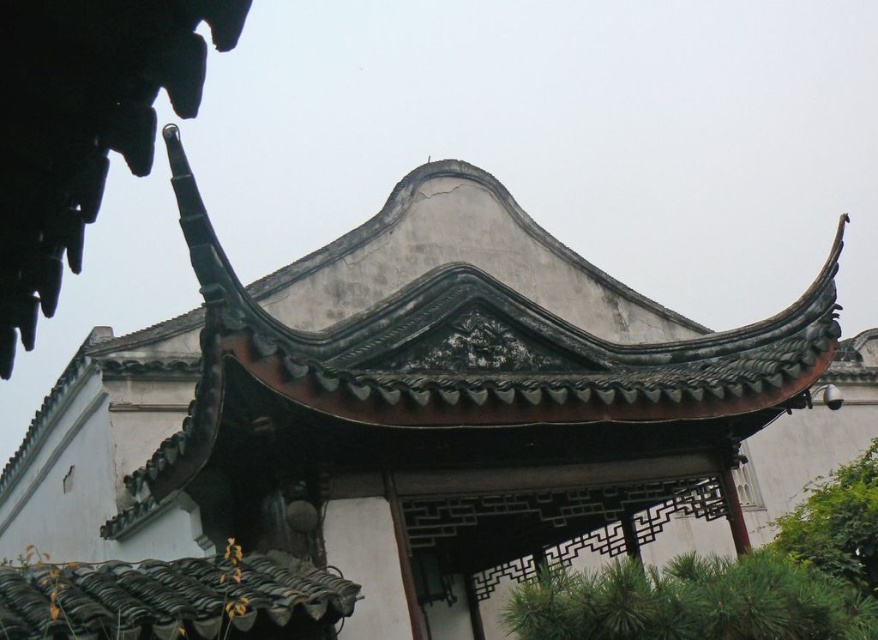
Is green needle-like leaves at lower right thinner than green leafy tree at lower right?

Yes.

Measure the distance between green needle-like leaves at lower right and camera.

green needle-like leaves at lower right and camera are 34.34 meters apart from each other.

The width and height of the screenshot is (878, 640). In order to click on green needle-like leaves at lower right in this screenshot , I will do `click(692, 602)`.

Image resolution: width=878 pixels, height=640 pixels. Identify the location of green needle-like leaves at lower right. tap(692, 602).